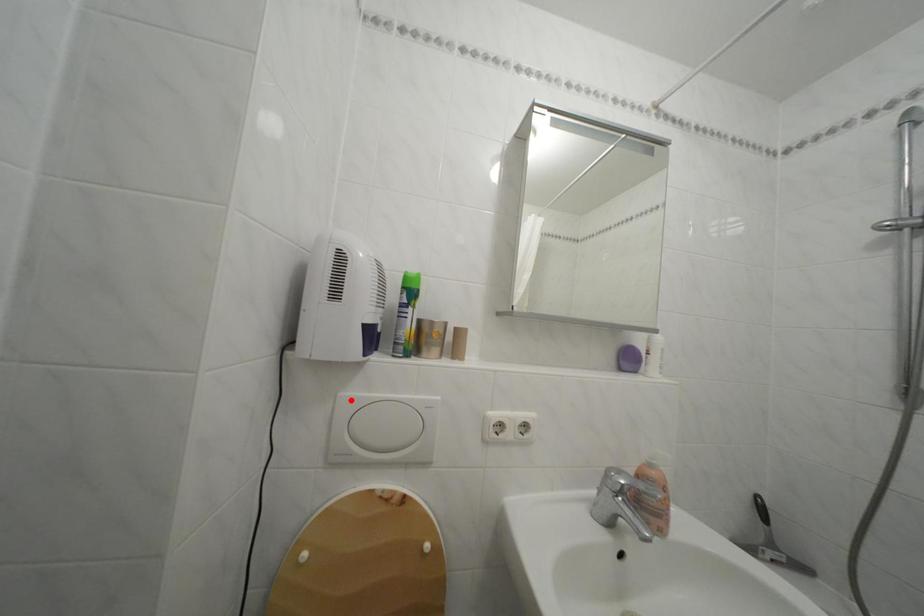
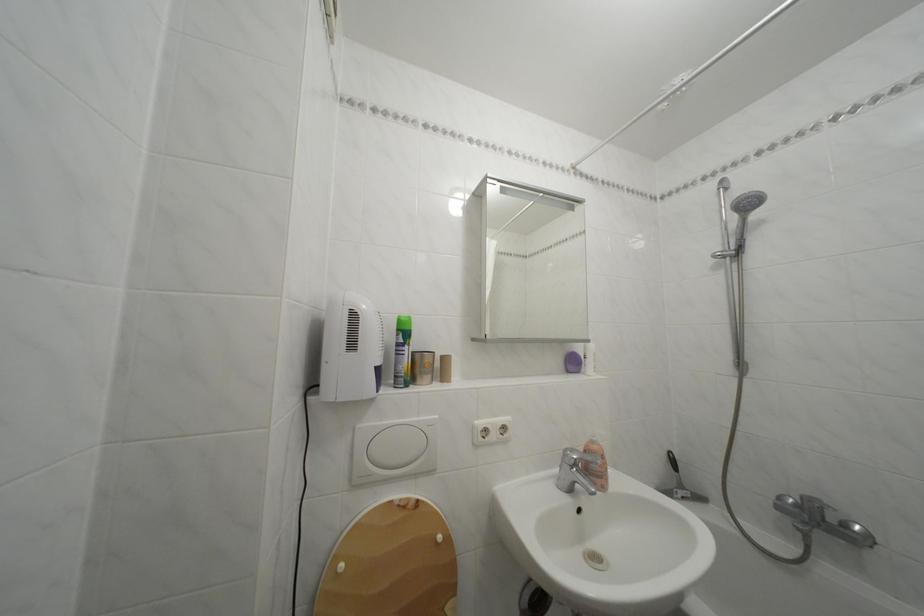
Locate, in the second image, the point that corresponds to the highlighted location in the first image.

(368, 432)